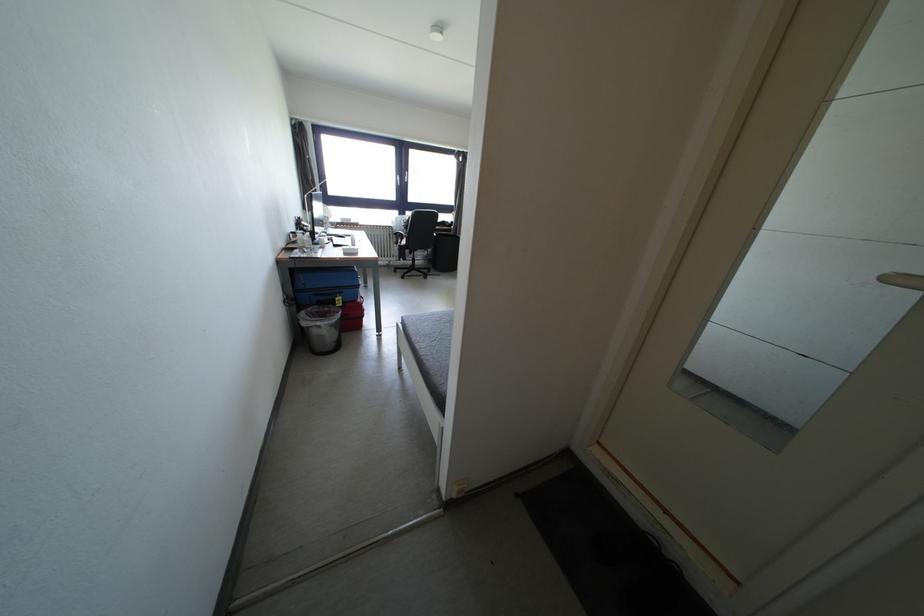
You are a GUI agent. You are given a task and a screenshot of the screen. Output one action in this format:
    pyautogui.click(x=<x>, y=<y>)
    Task: Click on the red suitcase
    The width and height of the screenshot is (924, 616).
    Given the screenshot: What is the action you would take?
    pyautogui.click(x=351, y=315)